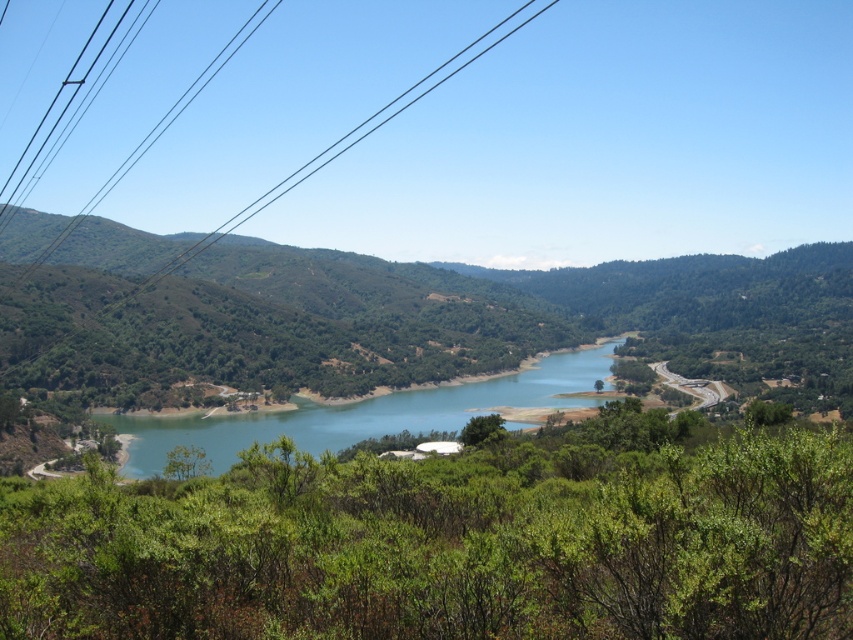
Question: Does green water at center lie behind black wire at upper left?

Choices:
 (A) yes
 (B) no

Answer: (B)

Question: Which of the following is the closest to the observer?

Choices:
 (A) green water at center
 (B) black wire at upper left

Answer: (A)

Question: Does green water at center appear over black wire at upper left?

Choices:
 (A) yes
 (B) no

Answer: (B)

Question: Which point appears farthest from the camera in this image?

Choices:
 (A) (595, 352)
 (B) (393, 97)

Answer: (B)

Question: Is green water at center smaller than black wire at upper left?

Choices:
 (A) yes
 (B) no

Answer: (A)